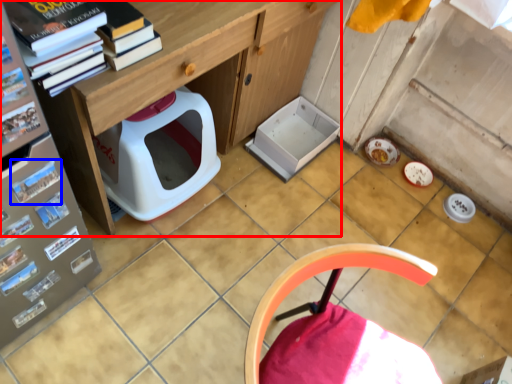
Question: Which object is further to the camera taking this photo, desk (highlighted by a red box) or paperback book (highlighted by a blue box)?

Choices:
 (A) desk
 (B) paperback book

Answer: (A)